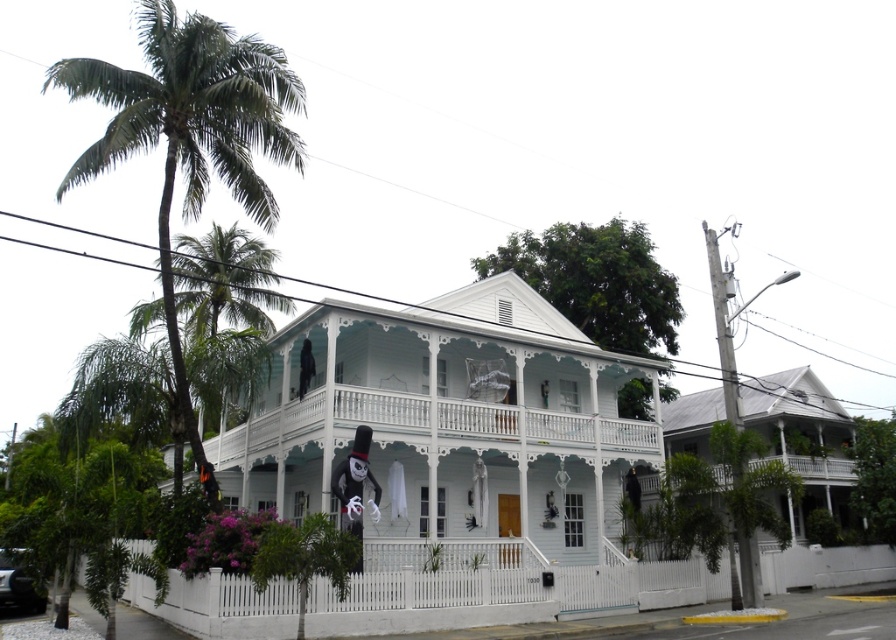
Question: Considering the real-world distances, which object is farthest from the white painted wood porch at center?

Choices:
 (A) green leafy palm tree at left
 (B) black glossy car at lower left

Answer: (B)

Question: Estimate the real-world distances between objects in this image. Which object is closer to the black glossy car at lower left?

Choices:
 (A) white painted wood porch at center
 (B) green leafy palm tree at left

Answer: (B)

Question: Can you confirm if green leafy palm tree at left is positioned above black glossy car at lower left?

Choices:
 (A) yes
 (B) no

Answer: (A)

Question: Is green leafy palm tree at left closer to camera compared to black glossy car at lower left?

Choices:
 (A) yes
 (B) no

Answer: (A)

Question: Which object appears farthest from the camera in this image?

Choices:
 (A) white painted wood porch at center
 (B) black glossy car at lower left

Answer: (A)

Question: Does green leafy palm tree at left have a smaller size compared to black glossy car at lower left?

Choices:
 (A) no
 (B) yes

Answer: (A)